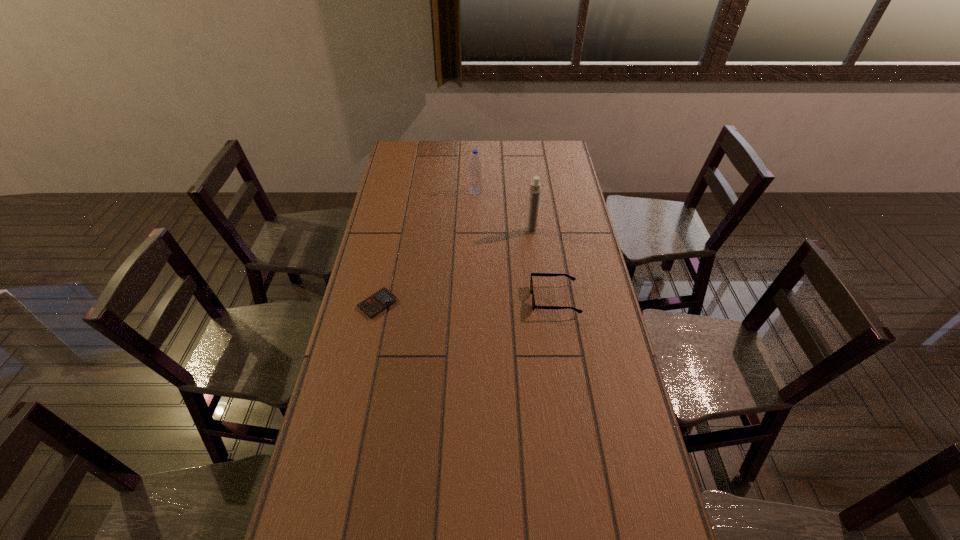
The width and height of the screenshot is (960, 540). Find the location of `the third nearest object`. the third nearest object is located at coordinates (534, 194).

Where is `the tallest object`? The width and height of the screenshot is (960, 540). the tallest object is located at coordinates (534, 194).

You are a GUI agent. You are given a task and a screenshot of the screen. Output one action in this format:
    pyautogui.click(x=<x>, y=<y>)
    Task: Click on the second tallest object
    
    Given the screenshot: What is the action you would take?
    pyautogui.click(x=475, y=175)

Where is `water bottle`? The height and width of the screenshot is (540, 960). water bottle is located at coordinates (475, 175).

Where is `spectacles`? The width and height of the screenshot is (960, 540). spectacles is located at coordinates (532, 274).

The image size is (960, 540). Find the location of `the leftmost object`. the leftmost object is located at coordinates (382, 299).

The height and width of the screenshot is (540, 960). In order to click on the shortest object in this screenshot , I will do `click(382, 299)`.

At what (x,y) coordinates should I click in order to perform the action: click on free space located 0.210m on the front of the tallest object. Please return your answer as a coordinate pair (x, y). Image resolution: width=960 pixels, height=540 pixels. Looking at the image, I should click on (536, 271).

Identify the location of free space located 0.270m on the front of the third shortest object. The image size is (960, 540). (475, 234).

The height and width of the screenshot is (540, 960). What are the coordinates of `vacant point located 0.280m on the arms of the third tallest object` in the screenshot? It's located at (450, 299).